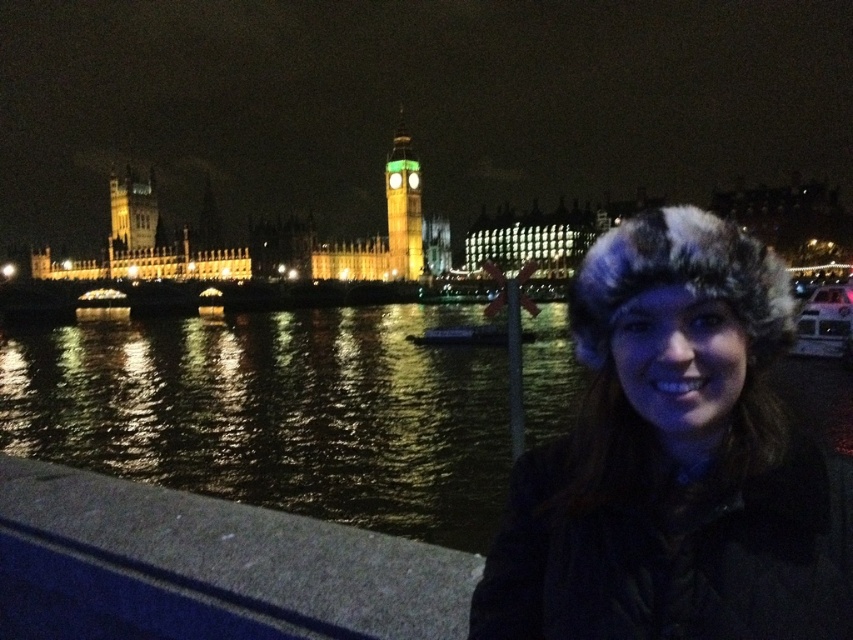
You are a tour guide leading a group to the Houses of Parliament. You want to take a photo where both the glossy water at lower left and the green glass clock tower at center are in focus. The camera you have can only focus on objects within a 50 feet range. Is this possible?

The glossy water at lower left and green glass clock tower at center are 78.75 feet apart from each other. Since the camera can only focus within a 50 feet range, capturing both in focus simultaneously is not possible as the distance exceeds the camera limitation.

You are a photographer trying to capture the Houses of Parliament and Big Ben in the background. You notice the fuzzy fur hat at lower right and the glossy water at lower left in your frame. Which object takes up more space in the photo?

The glossy water at lower left occupies more space than the fuzzy fur hat at lower right in the photo.

You are standing at the scene and want to take a photo of the green glass clock tower at center. There is a concrete at lower left in the way. Can you move to the right to avoid it?

The concrete at lower left is positioned on the left side of green glass clock tower at center. Moving to the right would allow you to avoid the concrete at lower left and capture the green glass clock tower at center without obstruction.